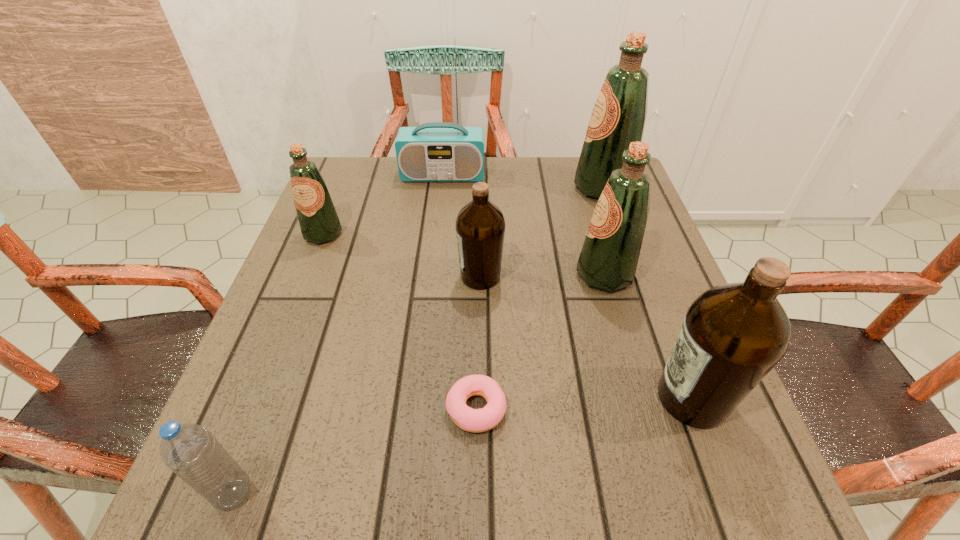
In order to click on olive oil located at the far edge in this screenshot , I will do `click(618, 118)`.

Locate an element on the screen. radio receiver present at the far edge is located at coordinates (437, 151).

Locate an element on the screen. The width and height of the screenshot is (960, 540). object at the near edge is located at coordinates (189, 450).

Where is `olive oil situated at the left edge`? This screenshot has height=540, width=960. olive oil situated at the left edge is located at coordinates (319, 222).

Identify the location of water bottle that is at the left edge. The width and height of the screenshot is (960, 540). (189, 450).

The height and width of the screenshot is (540, 960). I want to click on object at the near left corner, so click(189, 450).

Locate an element on the screen. Image resolution: width=960 pixels, height=540 pixels. object at the far right corner is located at coordinates (618, 118).

At what (x,y) coordinates should I click in order to perform the action: click on vacant region at the near edge of the desktop. Please return your answer as a coordinate pair (x, y). This screenshot has width=960, height=540. Looking at the image, I should click on (491, 478).

Image resolution: width=960 pixels, height=540 pixels. In the image, there is a desktop. Find the location of `free space at the left edge`. free space at the left edge is located at coordinates (290, 392).

The height and width of the screenshot is (540, 960). In the image, there is a desktop. In order to click on vacant region at the right edge in this screenshot , I will do `click(651, 319)`.